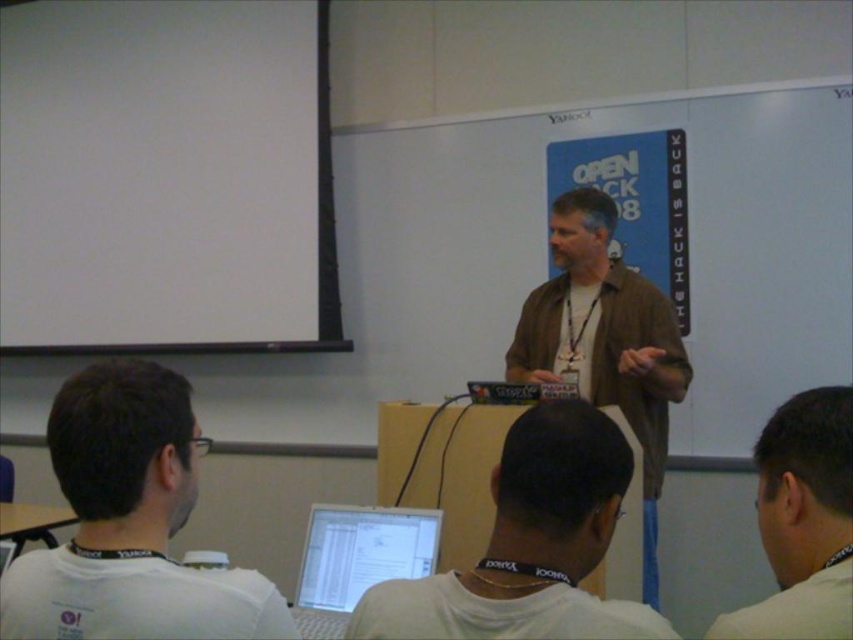
You are an attendee in the classroom and need to take a photo of the presentation. The white matte projection screen at upper left and the white matte shirt at lower left are both in your camera frame. Which object should you focus on to ensure the presentation content is clearly visible?

The white matte projection screen at upper left is taller than the white matte shirt at lower left, so focusing on the white matte projection screen at upper left will ensure the presentation content is clearly visible.

You are an attendee at the presentation and need to identify which object is smaller between the white matte shirt at lower left and the white glossy laptop at center. Can you determine this?

The white matte shirt at lower left is smaller than the white glossy laptop at center.

You are a photographer in the classroom and want to capture a photo of the white glossy laptop at center without including the white matte shirt at lower left in the frame. Is this possible based on their positions?

The white matte shirt at lower left is above the white glossy laptop at center, so it is blocking the view. Therefore, it is not possible to capture the white glossy laptop at center without including the white matte shirt at lower left in the frame.